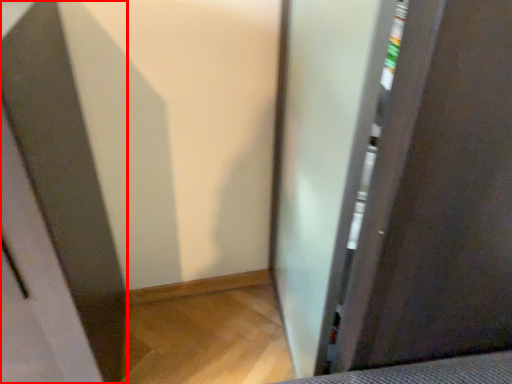
Question: From the image's perspective, where is screen door (annotated by the red box) located relative to screen door?

Choices:
 (A) below
 (B) above

Answer: (A)